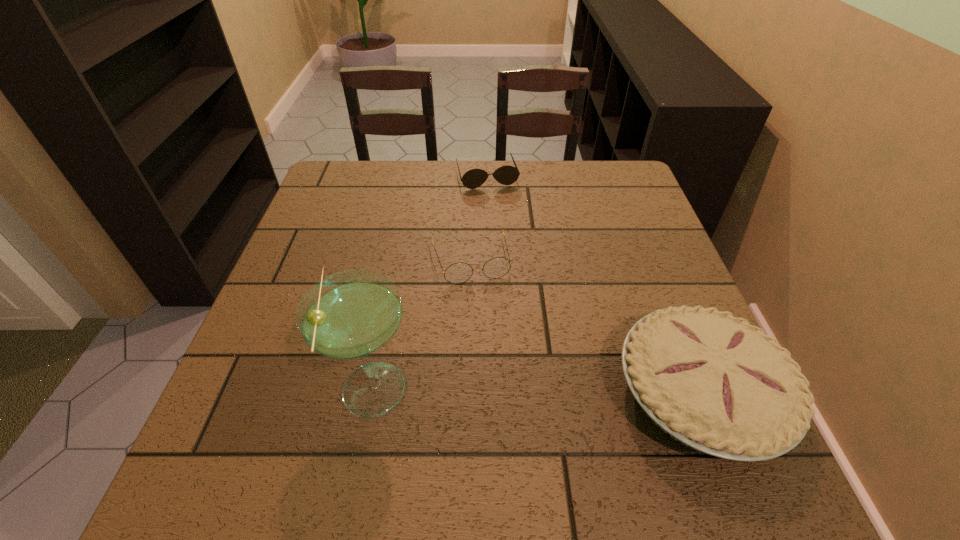
This screenshot has width=960, height=540. In order to click on free region at the left edge of the desktop in this screenshot , I will do `click(288, 382)`.

The height and width of the screenshot is (540, 960). In the image, there is a desktop. In order to click on free region at the right edge in this screenshot , I will do `click(649, 302)`.

The height and width of the screenshot is (540, 960). In the image, there is a desktop. Find the location of `free space at the far left corner`. free space at the far left corner is located at coordinates (329, 197).

Image resolution: width=960 pixels, height=540 pixels. What are the coordinates of `vacant area at the far right corner of the desktop` in the screenshot? It's located at click(617, 194).

Find the location of a particular element. This screenshot has height=540, width=960. unoccupied area between the spectacles and the tallest object is located at coordinates (421, 324).

This screenshot has width=960, height=540. In order to click on free space that is in between the sunglasses and the third nearest object in this screenshot , I will do `click(478, 218)`.

You are a GUI agent. You are given a task and a screenshot of the screen. Output one action in this format:
    pyautogui.click(x=<x>, y=<y>)
    Task: Click on the vacant point located between the martini and the rightmost object
    This screenshot has width=960, height=540.
    Given the screenshot: What is the action you would take?
    pyautogui.click(x=537, y=391)

This screenshot has height=540, width=960. Identify the location of free space between the pie and the spectacles. (584, 326).

You are a GUI agent. You are given a task and a screenshot of the screen. Output one action in this format:
    pyautogui.click(x=<x>, y=<y>)
    Task: Click on the free point between the second tallest object and the martini
    
    Given the screenshot: What is the action you would take?
    pyautogui.click(x=537, y=391)

Where is `unoccupied area between the rightmost object and the sunglasses`? This screenshot has height=540, width=960. unoccupied area between the rightmost object and the sunglasses is located at coordinates (593, 285).